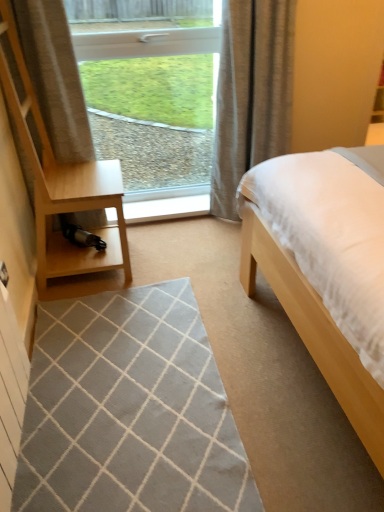
I want to click on vacant region above gray woven mat at center (from a real-world perspective), so click(x=117, y=398).